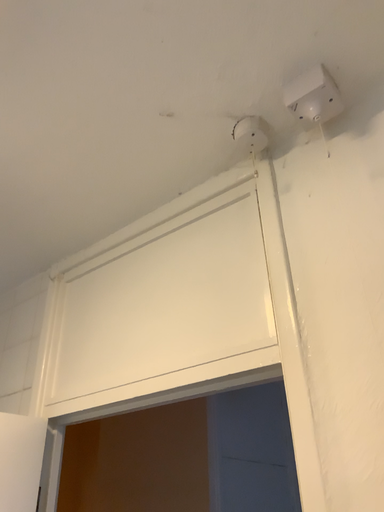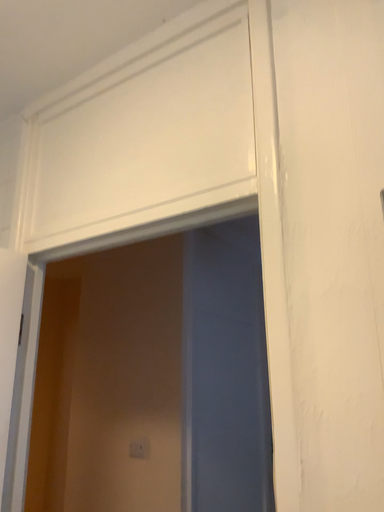
Question: How did the camera likely rotate when shooting the video?

Choices:
 (A) rotated upward
 (B) rotated downward

Answer: (B)